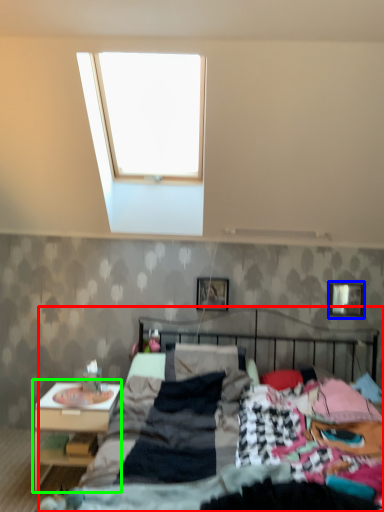
Question: Considering the real-world distances, which object is closest to bed (highlighted by a red box)? picture frame (highlighted by a blue box) or nightstand (highlighted by a green box).

Choices:
 (A) picture frame
 (B) nightstand

Answer: (B)